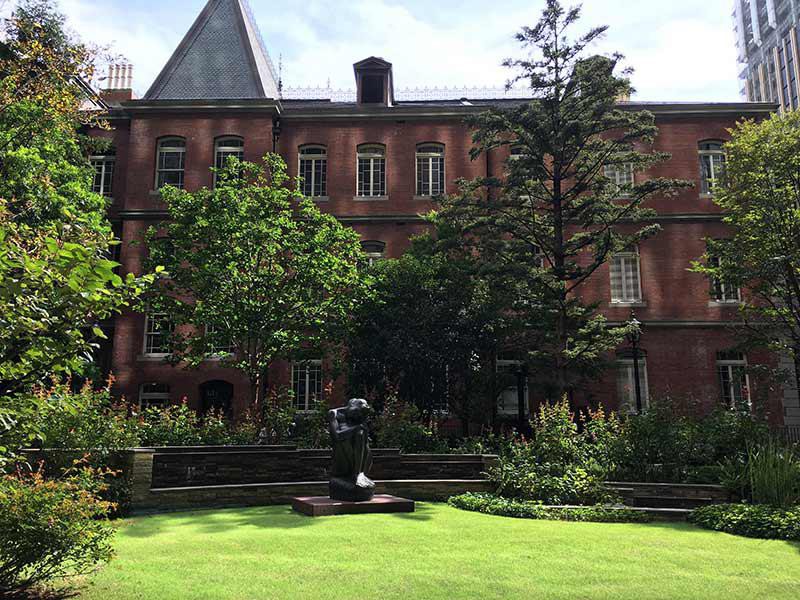
At what (x,y) coordinates should I click in order to perform the action: click on statue. Please return your answer as a coordinate pair (x, y). This screenshot has width=800, height=600. Looking at the image, I should click on (357, 467).